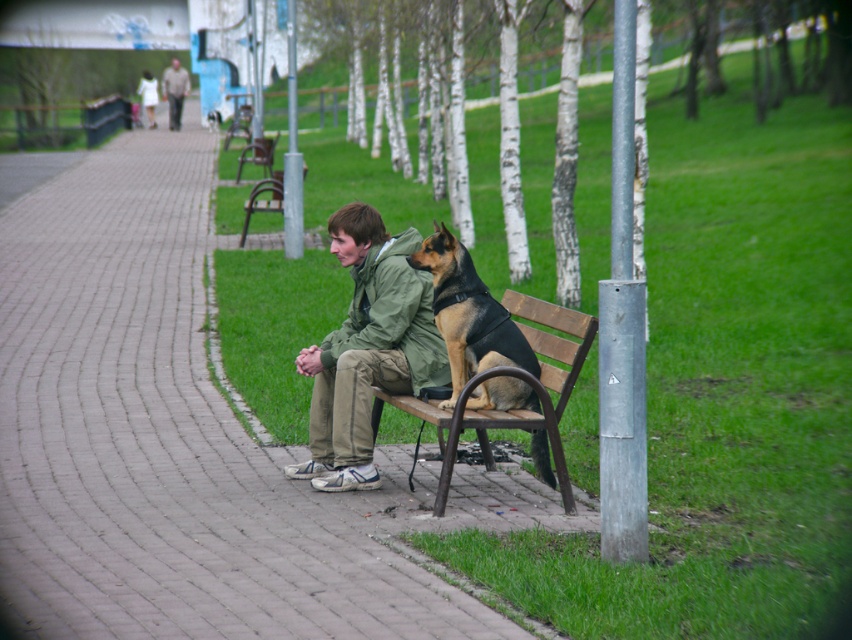
Question: Can you confirm if wooden bench at center is bigger than brown wooden bench at center?

Choices:
 (A) no
 (B) yes

Answer: (B)

Question: Is wooden bench at center above black leather dog at center?

Choices:
 (A) yes
 (B) no

Answer: (B)

Question: Based on their relative distances, which object is farther from the black leather dog at center?

Choices:
 (A) metallic brown bench at center
 (B) green matte jacket at center
 (C) brown wooden bench at center
 (D) camouflage fabric jacket at upper center

Answer: (D)

Question: From the image, what is the correct spatial relationship of wooden bench at center in relation to brown wooden bench at center?

Choices:
 (A) above
 (B) below

Answer: (B)

Question: Which of the following is the closest to the observer?

Choices:
 (A) [446, 486]
 (B) [239, 176]

Answer: (A)

Question: Which is farther from the camouflage fabric jacket at upper center?

Choices:
 (A) metallic brown bench at center
 (B) green matte jacket at center
 (C) black leather dog at center

Answer: (C)